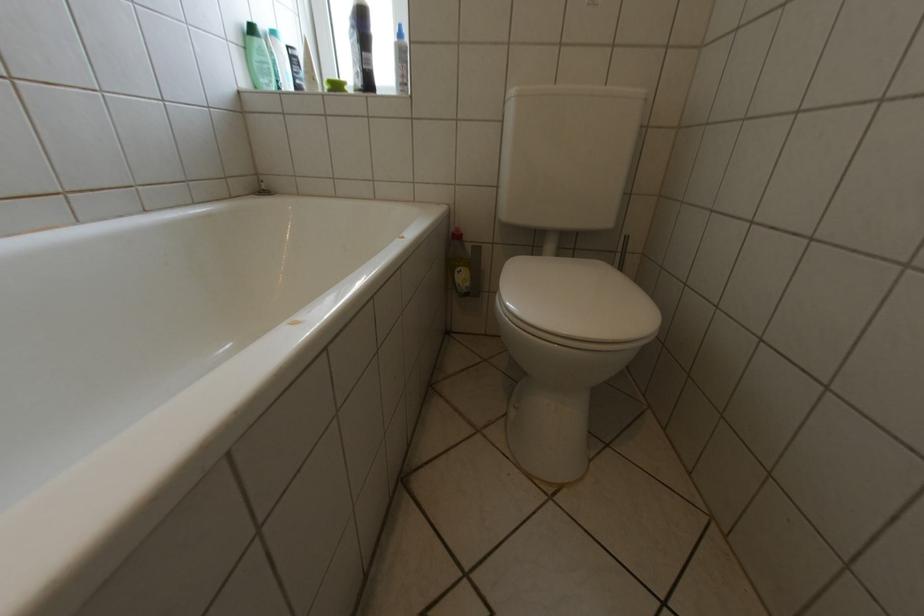
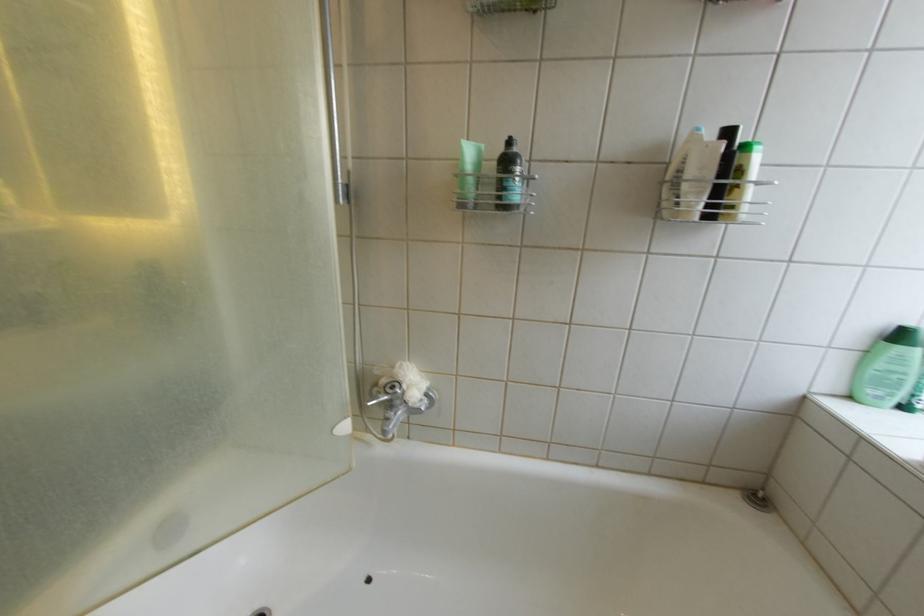
Where in the second image is the point corresponding to pixel 274 52 from the first image?

(914, 361)